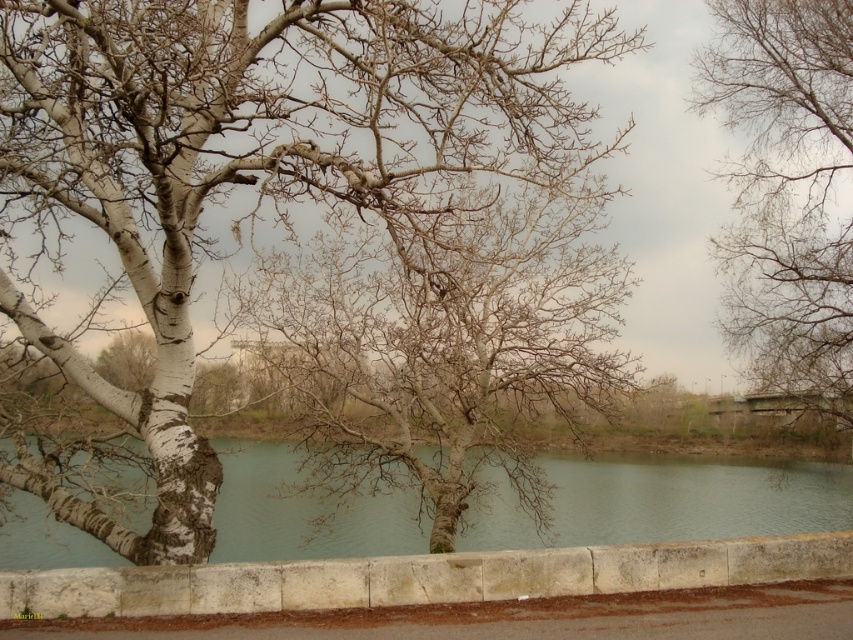
Question: Which object is the closest to the greenish water at center?

Choices:
 (A) stone curb at lower center
 (B) bare branches at center
 (C) white bark tree at center

Answer: (B)

Question: Estimate the real-world distances between objects in this image. Which object is farther from the white bark tree at center?

Choices:
 (A) greenish water at center
 (B) bare branches at center
 (C) stone curb at lower center

Answer: (A)

Question: In this image, where is white bark tree at center located relative to bare branches at upper right?

Choices:
 (A) right
 (B) left

Answer: (B)

Question: Can you confirm if white bark tree at center is bigger than greenish water at center?

Choices:
 (A) no
 (B) yes

Answer: (A)

Question: Is bare branches at center further to camera compared to greenish water at center?

Choices:
 (A) yes
 (B) no

Answer: (A)

Question: Which point is farther to the camera?

Choices:
 (A) greenish water at center
 (B) bare branches at upper right

Answer: (B)